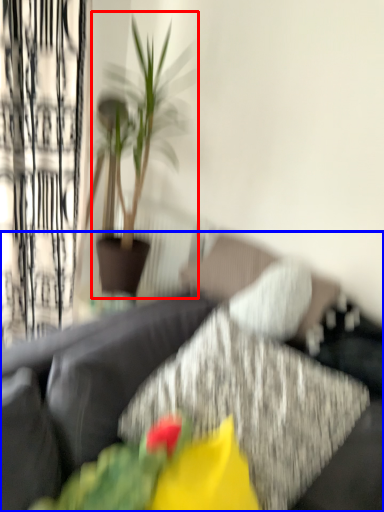
Question: Among these objects, which one is farthest to the camera, houseplant (highlighted by a red box) or studio couch (highlighted by a blue box)?

Choices:
 (A) houseplant
 (B) studio couch

Answer: (A)